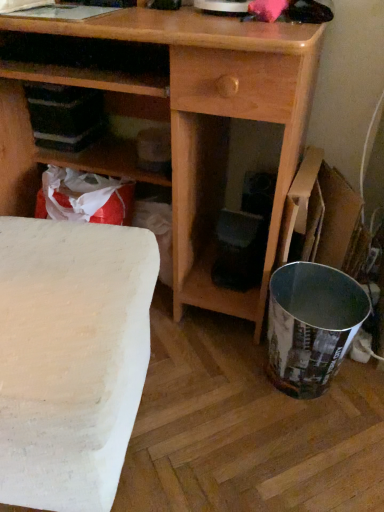
Question: Considering the positions of point (311, 225) and point (8, 17), is point (311, 225) closer or farther from the camera than point (8, 17)?

Choices:
 (A) closer
 (B) farther

Answer: (B)

Question: From the image's perspective, is cardboard box at right above or below wooden desk at center?

Choices:
 (A) above
 (B) below

Answer: (B)

Question: Which object is the farthest from the white matte table at lower left?

Choices:
 (A) cardboard box at right
 (B) wooden desk at center

Answer: (A)

Question: Considering the real-world distances, which object is closest to the white matte table at lower left?

Choices:
 (A) cardboard box at right
 (B) wooden desk at center

Answer: (B)